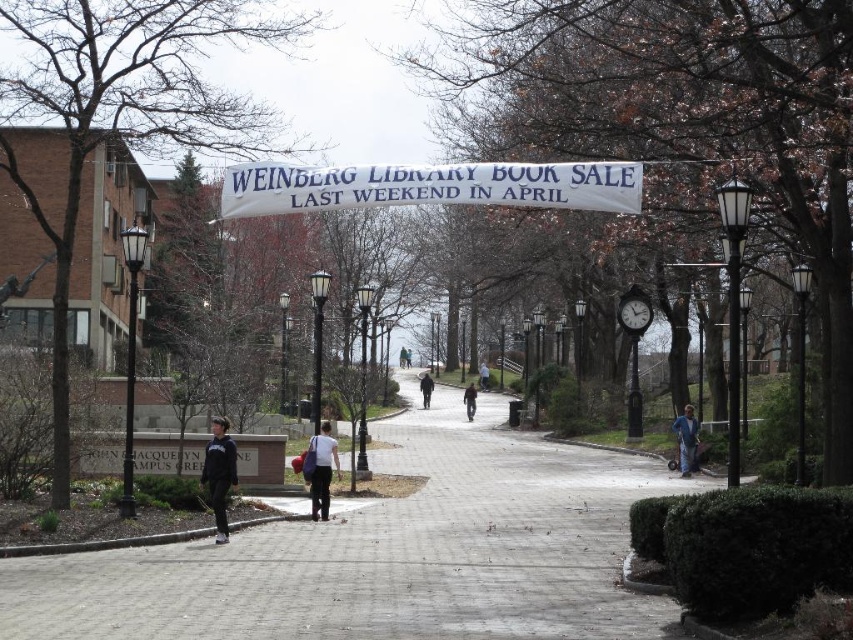
You are standing on the paved pathway and see both the dark blue jeans at center and the white cotton jacket at center. Which one is closer to you?

The dark blue jeans at center is closer to you because it is in front of the white cotton jacket at center.

You are a student carrying a dark brown leather jacket at center and want to walk under the white fabric banner at center. Can you pass through without the jacket getting caught on the banner?

The white fabric banner at center is wider than dark brown leather jacket at center, so you can pass through without the jacket getting caught on the banner.